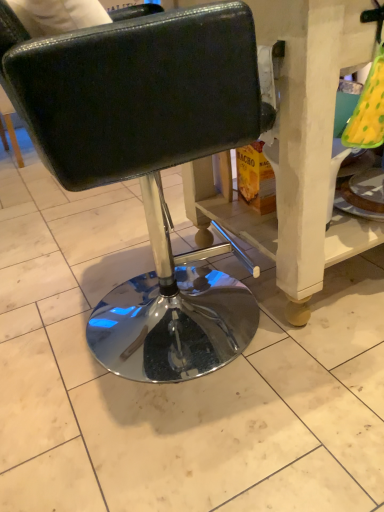
Image resolution: width=384 pixels, height=512 pixels. In order to click on black leather chair at center in this screenshot , I will do `click(149, 166)`.

Describe the element at coordinates (149, 166) in the screenshot. I see `black leather chair at center` at that location.

At what (x,y) coordinates should I click in order to perform the action: click on black leather chair at center. Please return your answer as a coordinate pair (x, y). The image size is (384, 512). Looking at the image, I should click on (149, 166).